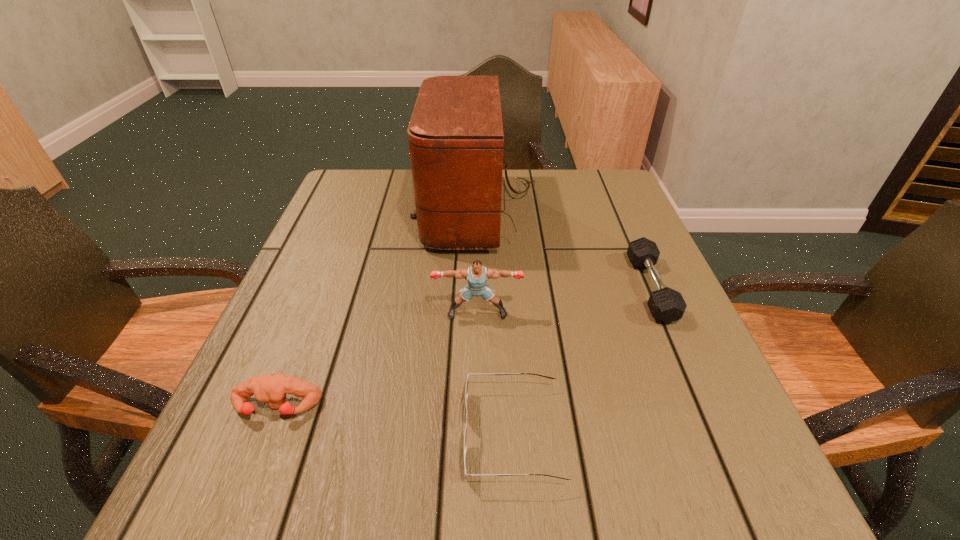
Where is `free point located 0.150m on the front-facing side of the farther puncher`? The height and width of the screenshot is (540, 960). free point located 0.150m on the front-facing side of the farther puncher is located at coordinates (477, 386).

Locate an element on the screen. This screenshot has width=960, height=540. blank space located 0.240m on the front of the dumbbell is located at coordinates (718, 445).

The width and height of the screenshot is (960, 540). Find the location of `vacant space situated 0.050m with the gloves of the leftmost object facing forward`. vacant space situated 0.050m with the gloves of the leftmost object facing forward is located at coordinates click(257, 456).

You are a GUI agent. You are given a task and a screenshot of the screen. Output one action in this format:
    pyautogui.click(x=<x>, y=<y>)
    Task: Click on the vacant position located on the front-facing side of the sunglasses
    The width and height of the screenshot is (960, 540).
    Given the screenshot: What is the action you would take?
    pyautogui.click(x=426, y=434)

You are a GUI agent. You are given a task and a screenshot of the screen. Output one action in this format:
    pyautogui.click(x=<x>, y=<y>)
    Task: Click on the vacant space located on the front-facing side of the sunglasses
    The width and height of the screenshot is (960, 540).
    Given the screenshot: What is the action you would take?
    pyautogui.click(x=262, y=434)

Identify the location of blank space located on the front-facing side of the sunglasses. Image resolution: width=960 pixels, height=540 pixels. [x=236, y=434].

This screenshot has height=540, width=960. Find the location of `object located at the far edge`. object located at the far edge is located at coordinates (455, 135).

This screenshot has width=960, height=540. I want to click on object that is at the near edge, so (467, 383).

I want to click on object that is at the left edge, so click(x=270, y=388).

At what (x,y) coordinates should I click in order to perform the action: click on object positioned at the right edge. Please return your answer as a coordinate pair (x, y). The image size is (960, 540). Looking at the image, I should click on (665, 304).